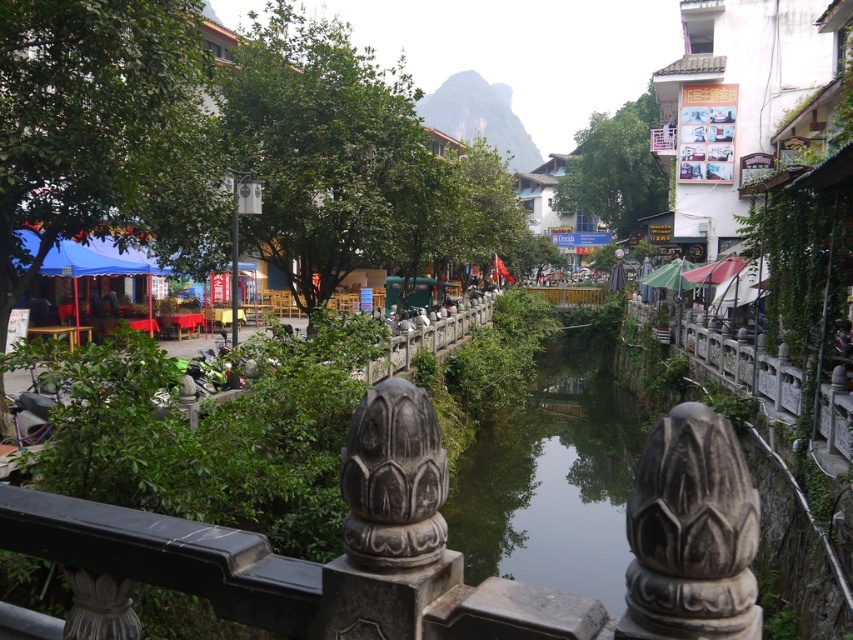
Question: Is gray stone sculpture at center wider than dark gray stone sculpture at center?

Choices:
 (A) no
 (B) yes

Answer: (B)

Question: Is gray stone sculpture at center smaller than dark gray stone sculpture at center?

Choices:
 (A) no
 (B) yes

Answer: (A)

Question: Is gray stone sculpture at center smaller than dark gray stone sculpture at center?

Choices:
 (A) yes
 (B) no

Answer: (B)